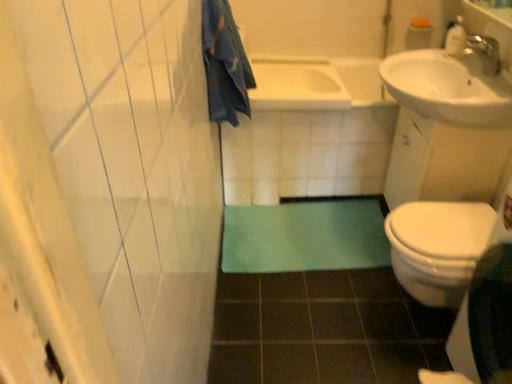
Where is `vacant space in front of silver metallic faucet at upper right`? This screenshot has height=384, width=512. vacant space in front of silver metallic faucet at upper right is located at coordinates (484, 89).